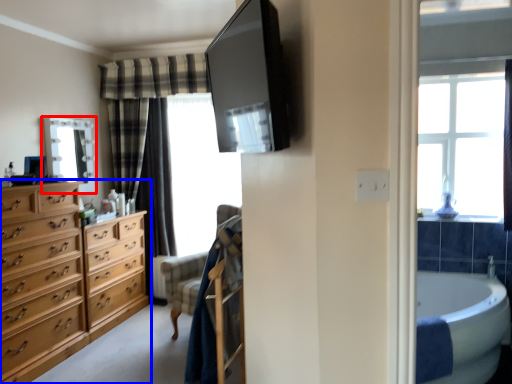
Question: Among these objects, which one is nearest to the camera, mirror (highlighted by a red box) or chest of drawers (highlighted by a blue box)?

Choices:
 (A) mirror
 (B) chest of drawers

Answer: (B)